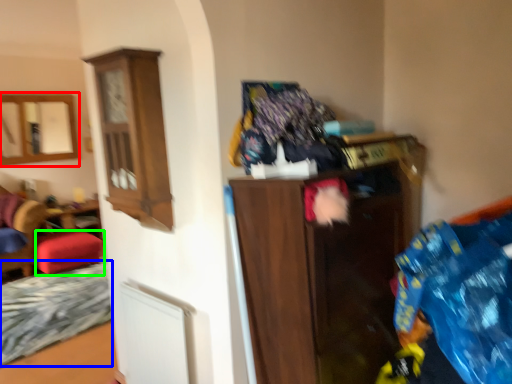
Question: Estimate the real-world distances between objects in this image. Which object is farther from mirror (highlighted by a red box), bed frame (highlighted by a blue box) or stool (highlighted by a green box)?

Choices:
 (A) bed frame
 (B) stool

Answer: (A)